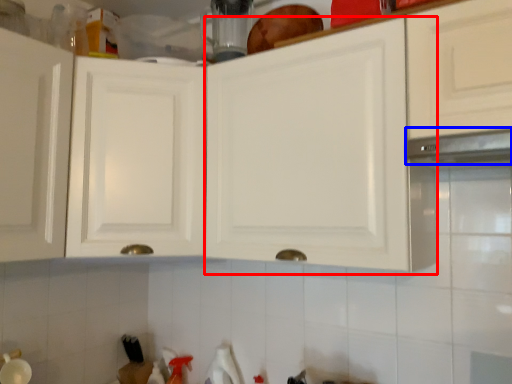
Question: Which of the following is the closest to the observer, cabinetry (highlighted by a red box) or exhaust hood (highlighted by a blue box)?

Choices:
 (A) cabinetry
 (B) exhaust hood

Answer: (B)